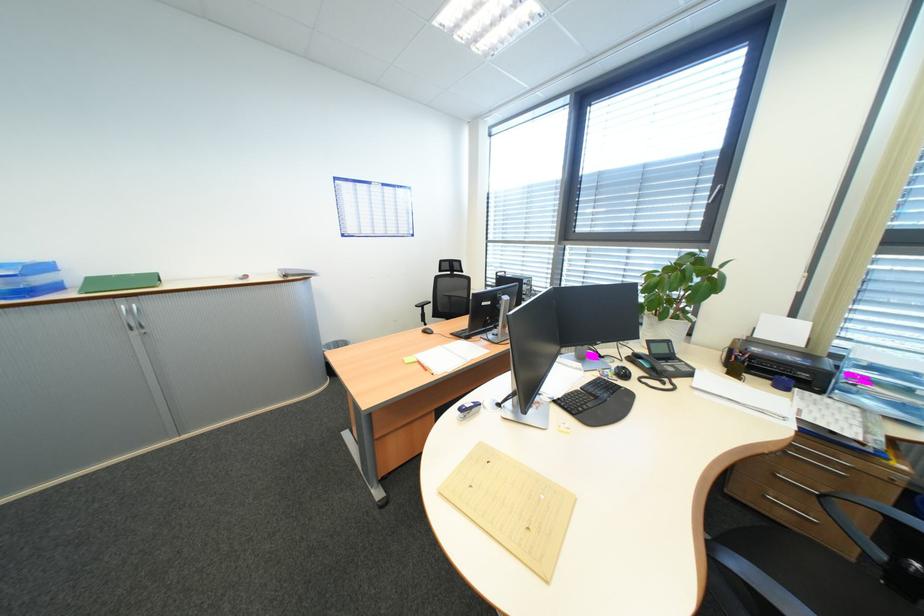
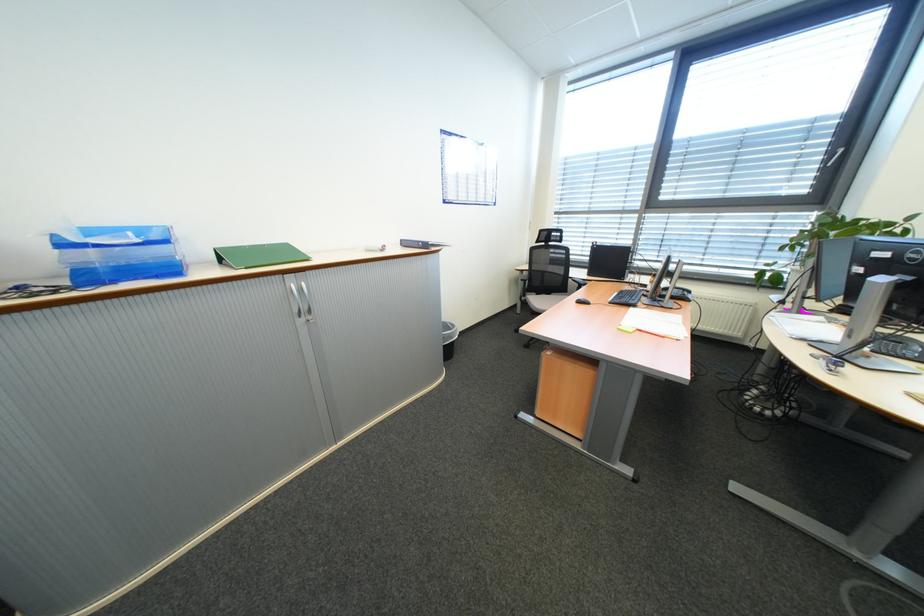
Question: What movement of the cameraman would produce the second image?

Choices:
 (A) Left
 (B) Right
 (C) Forward
 (D) Backward

Answer: (A)